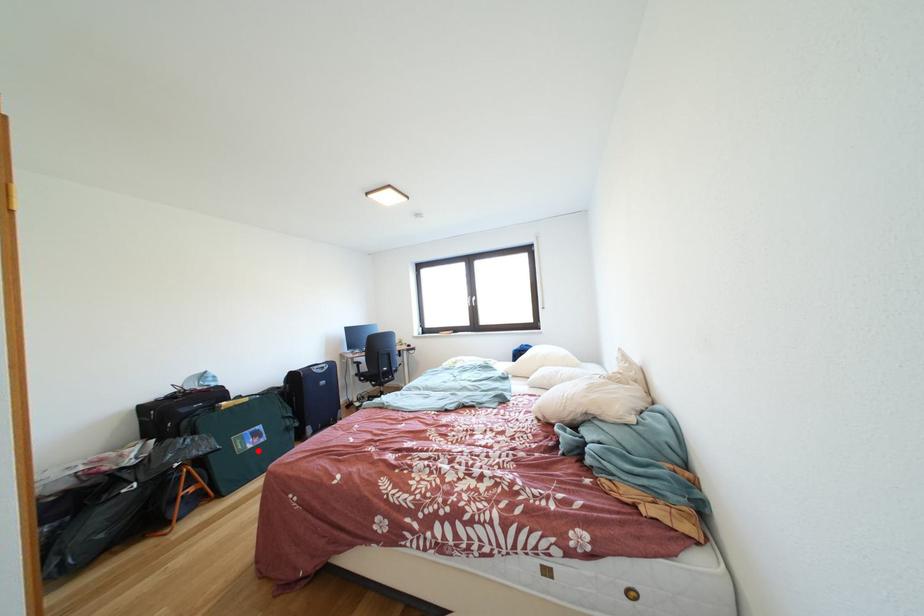
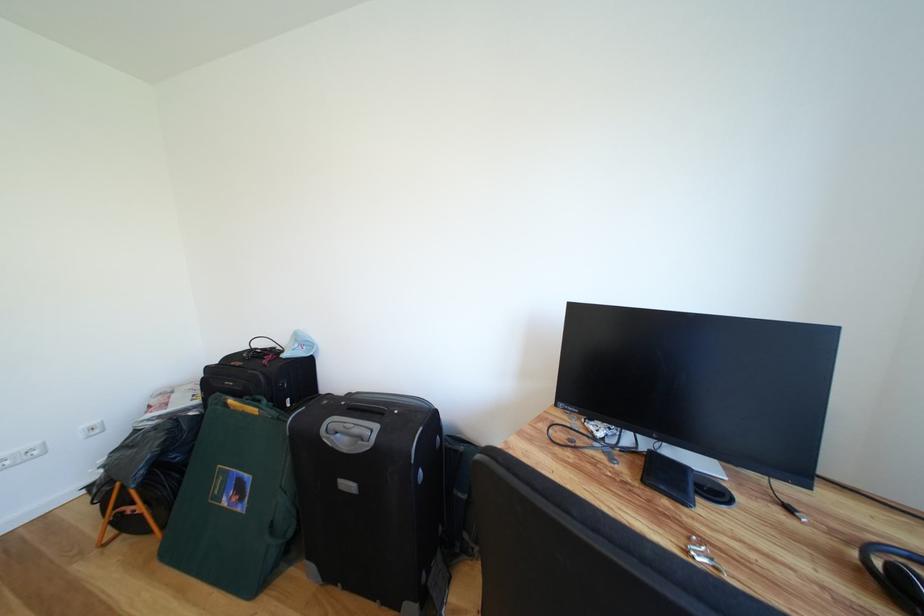
Where in the second image is the point corresponding to the highlighted location from the first image?

(234, 506)